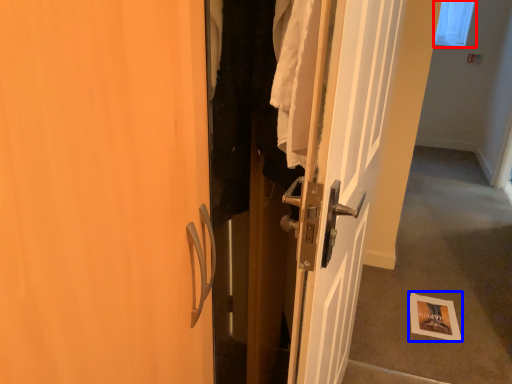
Question: Which object appears farthest to the camera in this image, window screen (highlighted by a red box) or postcard (highlighted by a blue box)?

Choices:
 (A) window screen
 (B) postcard

Answer: (A)